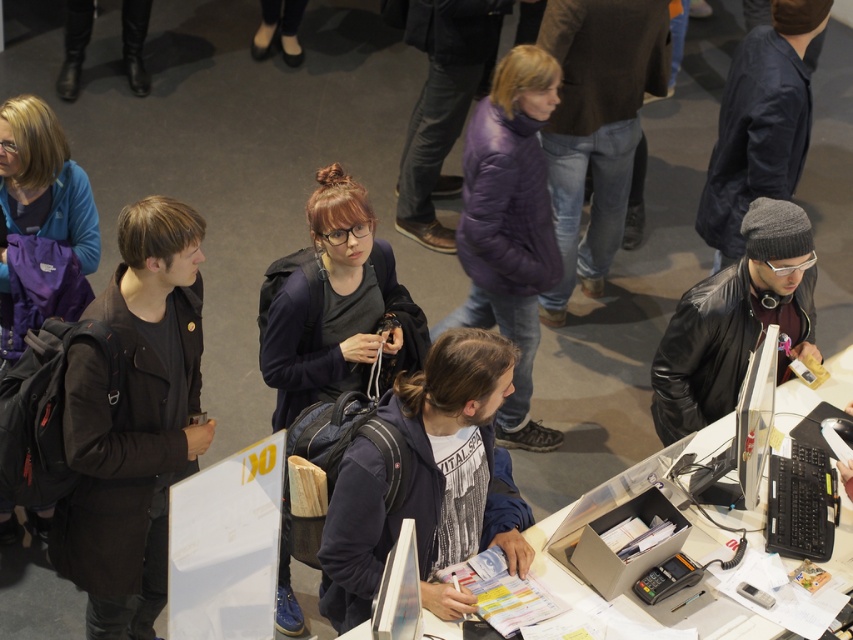
You are standing at the point marked as point (502, 145) in the image. You need to walk 3 meters forward in a straight line. Will you collide with any object or person in the scene?

The distance of point (502, 145) from camera is 4.00 meters. If you walk 3 meters forward from that point, you will be 1 meter away from the camera. Since the scene description mentions people scattered throughout the space but does not specify their exact positions relative to this point, there might be a risk of collision. However, the original position is 4 meters away, so after moving 3 meters, you are still 1 meter away from the camera, but the exact path and obstacles are not detailed in the given.